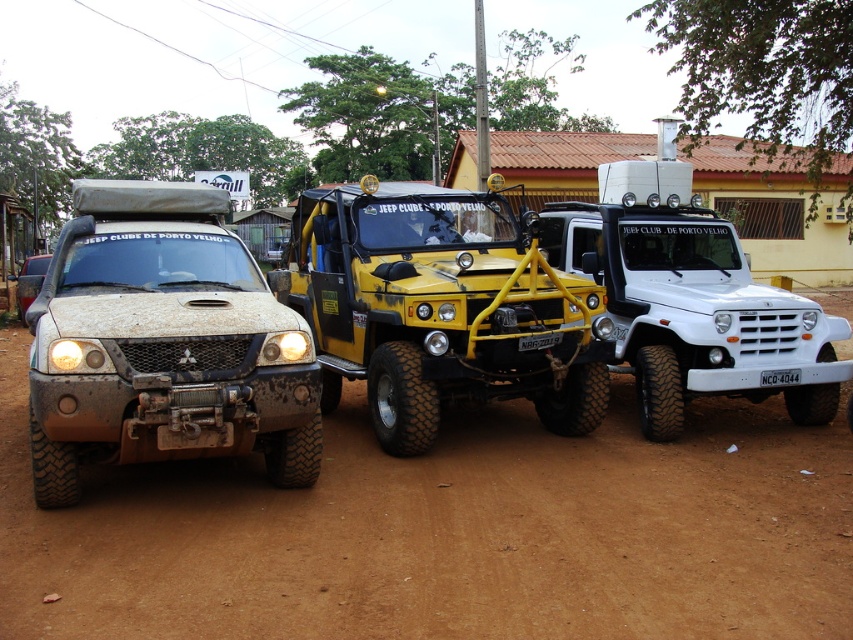
What is the color of the vehicle at the point marked by coordinates (163, 342)?

The vehicle at coordinates (163, 342) is a dusty matte truck.

From the picture: You are standing at the point with coordinates point (556, 218) and want to walk to the point with coordinates point (111, 294). In which direction should you move?

You should move forward because point (111, 294) is in front of point (556, 218).

You are standing on the road and want to clean the white matte jeep at center. Which part of the dusty brown dirt at center would you need to avoid stepping on to prevent soiling your shoes?

The dusty brown dirt at center is below the white matte jeep at center, so you should avoid stepping on the area directly under the vehicle to prevent soiling your shoes.